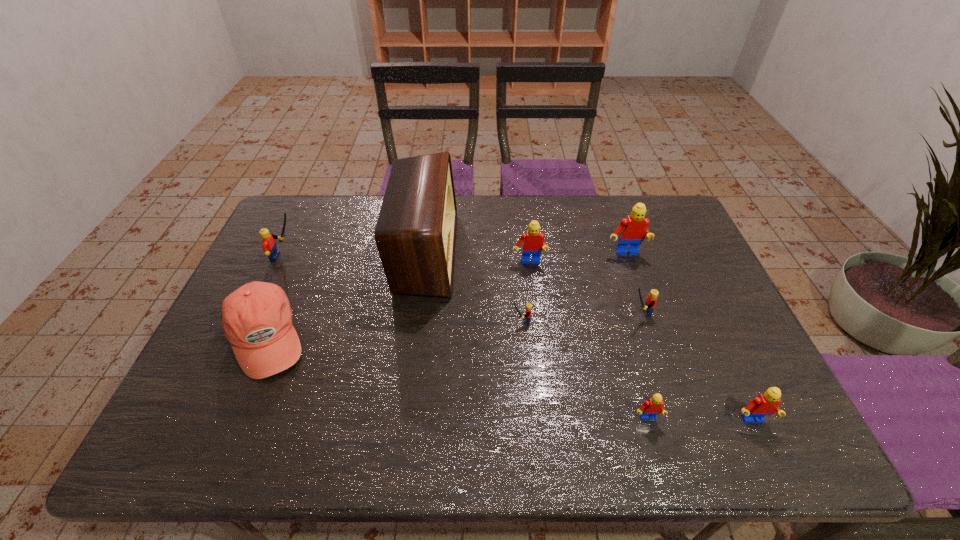
Find the location of `vacant space at the near edge of the desktop`. vacant space at the near edge of the desktop is located at coordinates (314, 445).

Identify the location of vacant position at the left edge of the desktop. The image size is (960, 540). (300, 246).

Locate an element on the screen. This screenshot has height=540, width=960. free point at the right edge is located at coordinates (708, 373).

Where is `free space at the far left corner of the desktop`? This screenshot has width=960, height=540. free space at the far left corner of the desktop is located at coordinates (299, 225).

Where is `vacant area at the far right corner`? The height and width of the screenshot is (540, 960). vacant area at the far right corner is located at coordinates (661, 237).

Find the location of a particular element. This screenshot has width=960, height=540. unoccupied area between the smallest red Lego and the rightmost object is located at coordinates (699, 420).

In order to click on vacant area that lies between the biggest red Lego and the rightmost red Lego in this screenshot , I will do `click(688, 338)`.

Locate an element on the screen. The image size is (960, 540). empty space between the biggest red Lego and the second yellow Lego from left to right is located at coordinates (573, 287).

I want to click on free space between the radio receiver and the second smallest red Lego, so click(x=588, y=337).

Locate an element on the screen. This screenshot has height=540, width=960. free space that is in between the second yellow Lego from right to left and the rightmost yellow Lego is located at coordinates (580, 316).